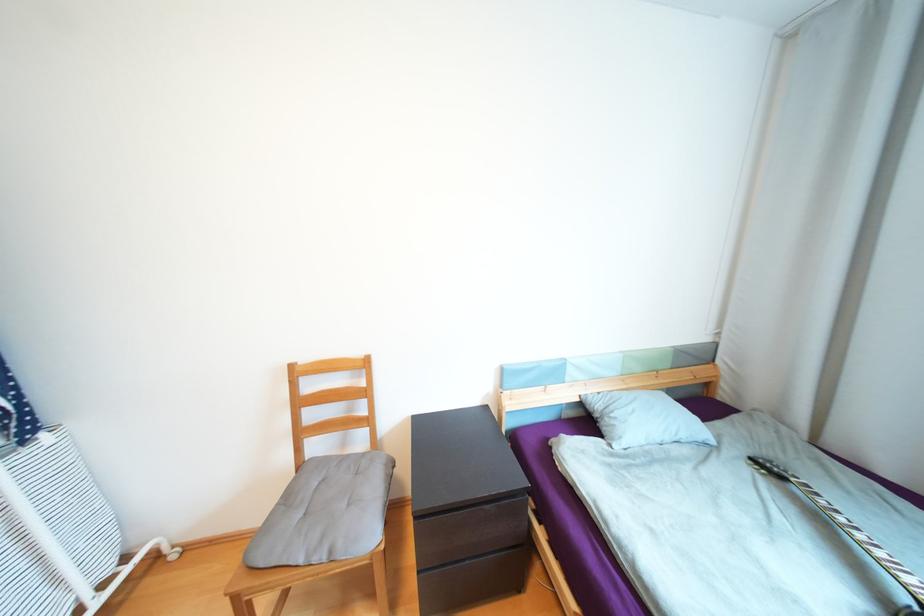
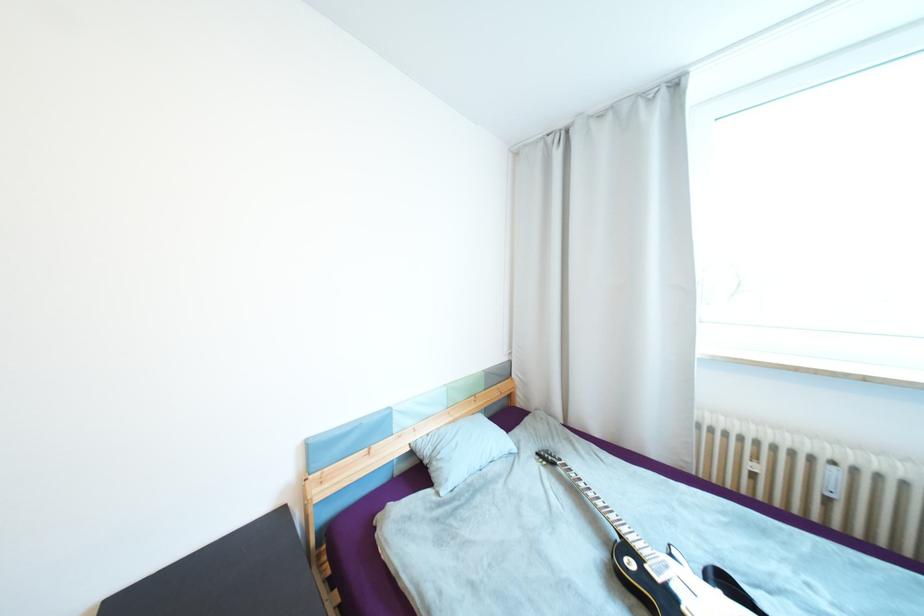
Question: How did the camera likely rotate?

Choices:
 (A) Left
 (B) Right
 (C) Up
 (D) Down

Answer: (B)